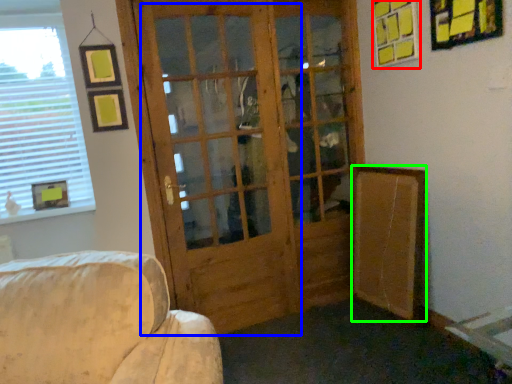
Question: Which object is positioned closest to picture frame (highlighted by a red box)? Select from screen door (highlighted by a blue box) and bulletin board (highlighted by a green box).

Choices:
 (A) screen door
 (B) bulletin board

Answer: (B)